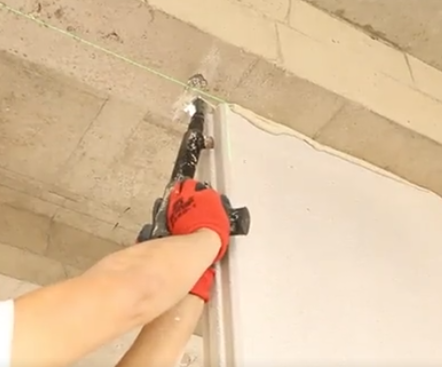
At what (x,y) coordinates should I click in order to perform the action: click on small light colored objedt on wall. Please return your answer as a coordinate pair (x, y). Looking at the image, I should click on (190, 359).